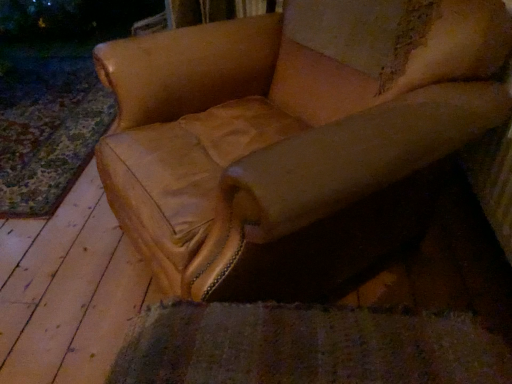
What do you see at coordinates (294, 138) in the screenshot?
I see `leather armchair at center` at bounding box center [294, 138].

The image size is (512, 384). I want to click on leather armchair at center, so click(x=294, y=138).

Image resolution: width=512 pixels, height=384 pixels. Identify the location of leather armchair at center. tap(294, 138).